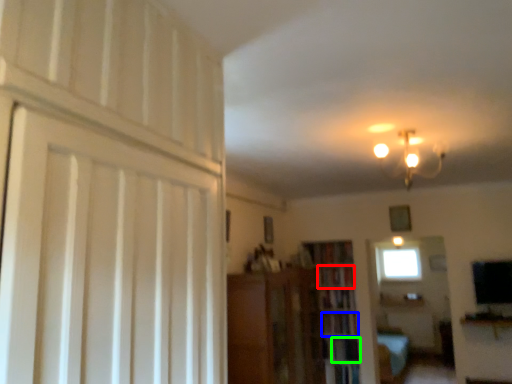
Question: Based on their relative distances, which object is nearer to book (highlighted by a red box)? Choose from book (highlighted by a blue box) and shelf (highlighted by a green box).

Choices:
 (A) book
 (B) shelf

Answer: (A)